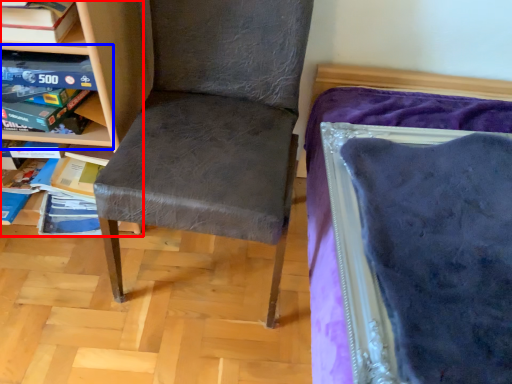
Question: Which object is further to the camera taking this photo, shelf (highlighted by a red box) or shelf (highlighted by a blue box)?

Choices:
 (A) shelf
 (B) shelf

Answer: (B)